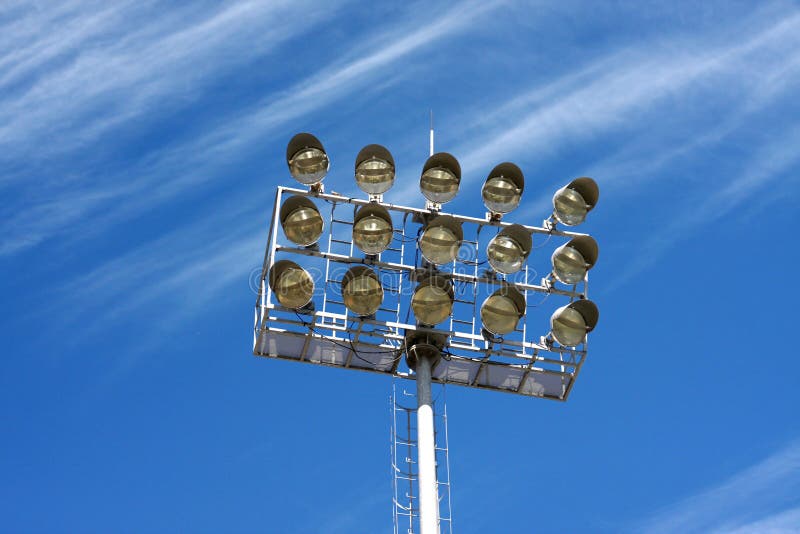
At what (x,y) coordinates should I click in order to perform the action: click on middle row of lights. Please return your answer as a coordinate pair (x, y). This screenshot has height=534, width=800. Looking at the image, I should click on (300, 225), (373, 225), (436, 235), (500, 243), (568, 252).